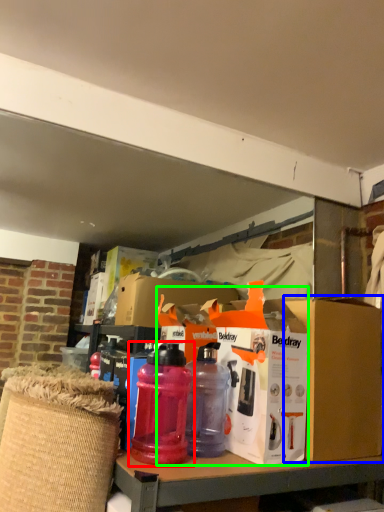
Question: Estimate the real-world distances between objects in this image. Which object is closer to bottle (highlighted by a red box), cardboard box (highlighted by a blue box) or box (highlighted by a green box)?

Choices:
 (A) cardboard box
 (B) box

Answer: (B)